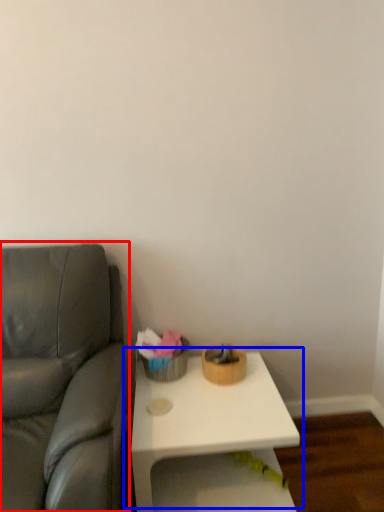
Question: Which point is closer to the camera, studio couch (highlighted by a red box) or table (highlighted by a blue box)?

Choices:
 (A) studio couch
 (B) table

Answer: (A)